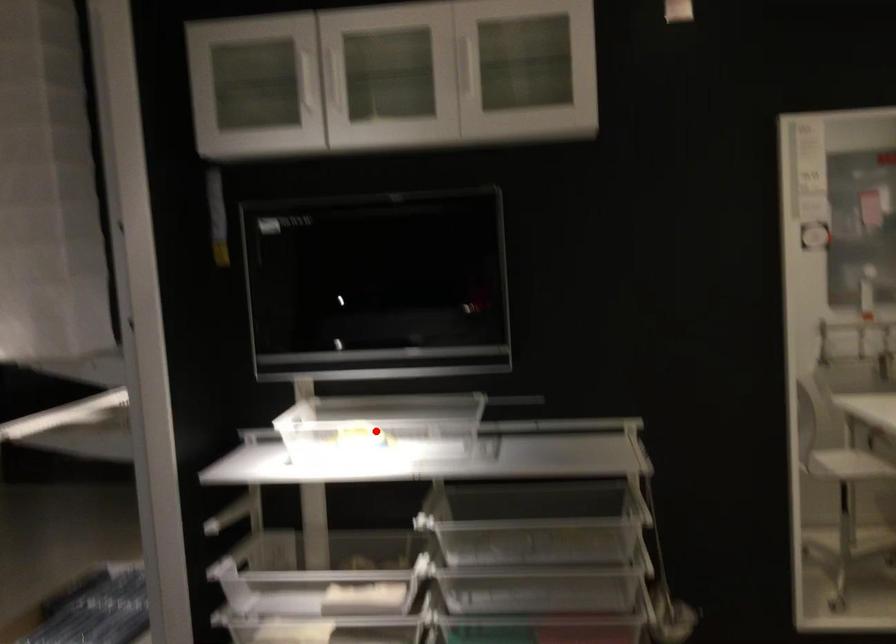
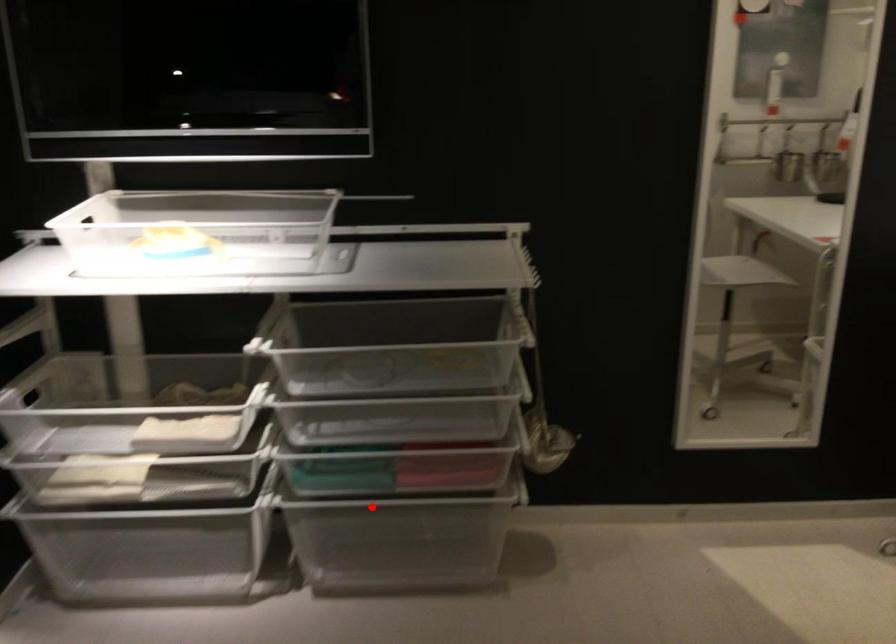
I am providing you with two images of the same scene from different viewpoints. A red point is marked on the first image and another point is marked on the second image. Does the point marked in image1 correspond to the same location as the one in image2?

No